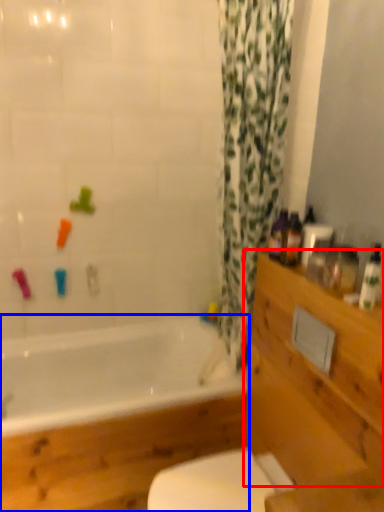
Question: Which object appears closest to the camera in this image, drawer (highlighted by a red box) or bathtub (highlighted by a blue box)?

Choices:
 (A) drawer
 (B) bathtub

Answer: (A)